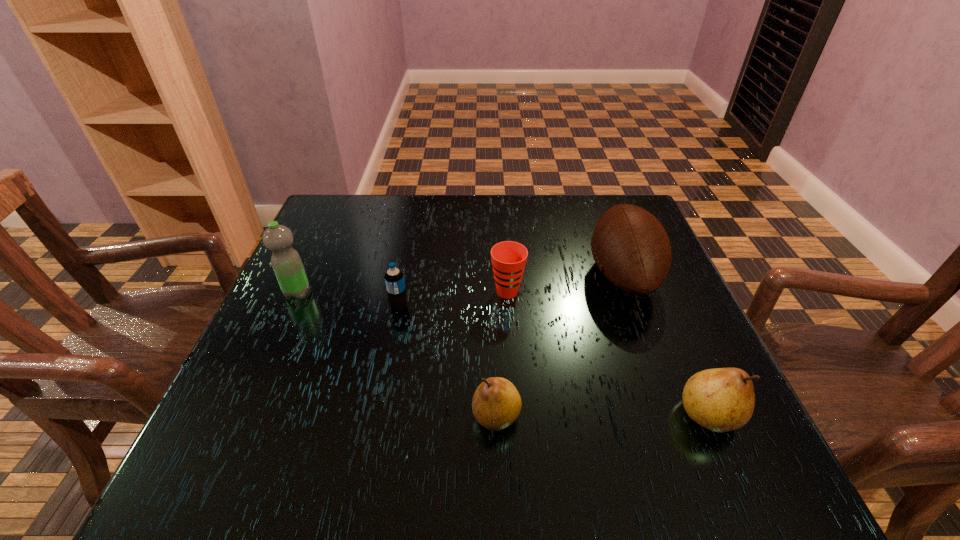
You are a GUI agent. You are given a task and a screenshot of the screen. Output one action in this format:
    pyautogui.click(x=<x>, y=<y>)
    Task: Click on the vacant area that lies between the water bottle and the right pear
    This screenshot has width=960, height=540.
    Given the screenshot: What is the action you would take?
    pyautogui.click(x=503, y=354)

Find the location of `free area in between the taller pear and the cup`. free area in between the taller pear and the cup is located at coordinates (608, 353).

Locate an element on the screen. vacant space that's between the cup and the football is located at coordinates (565, 283).

Locate an element on the screen. The image size is (960, 540). free spot between the water bottle and the soda bottle is located at coordinates (348, 300).

At what (x,y) coordinates should I click in order to perform the action: click on vacant space that is in between the water bottle and the taller pear. Please return your answer as a coordinate pair (x, y). The image size is (960, 540). Looking at the image, I should click on (503, 354).

Image resolution: width=960 pixels, height=540 pixels. Find the location of `free space that is in between the taller pear and the water bottle`. free space that is in between the taller pear and the water bottle is located at coordinates (503, 354).

At what (x,y) coordinates should I click in order to perform the action: click on object that ranks as the closest to the cup. Please return your answer as a coordinate pair (x, y). The width and height of the screenshot is (960, 540). Looking at the image, I should click on (631, 248).

Identify which object is the fifth closest to the right pear. Please provide its 2D coordinates. Your answer should be formatted as a tuple, i.e. [(x, y)], where the tuple contains the x and y coordinates of a point satisfying the conditions above.

[(286, 262)]

Locate an element on the screen. The image size is (960, 540). free space that satisfies the following two spatial constraints: 1. on the laces of the football; 2. on the front side of the soda bottle is located at coordinates (635, 307).